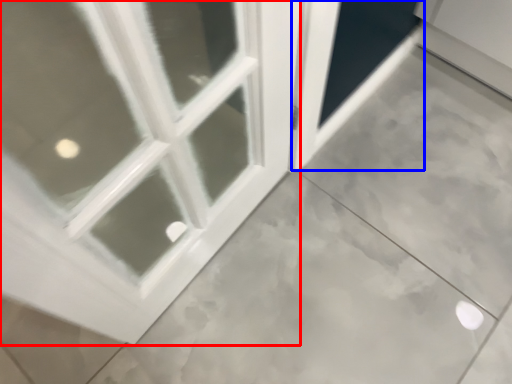
Question: Which object appears closest to the camera in this image, window (highlighted by a red box) or screen door (highlighted by a blue box)?

Choices:
 (A) window
 (B) screen door

Answer: (A)